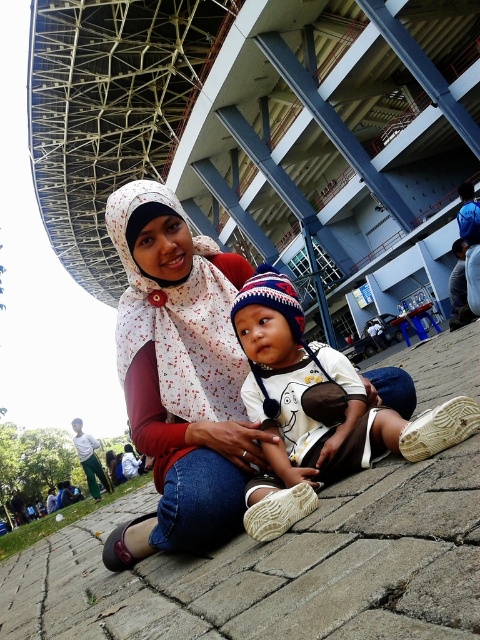
You are a photographer trying to capture a closeup of the white matte baby at center while ensuring the brick pavement at center is visible in the frame. Which object should you focus on first to keep both in the shot?

You should focus on the white matte baby at center first because the brick pavement at center is positioned on the left side of it, so keeping the baby centered will naturally include the pavement in the frame.

You are a photographer trying to capture a closeup of the white matte baby at center without including the brick pavement at center in the frame. Is this possible based on their positions?

The brick pavement at center is positioned under the white matte baby at center, so it is likely that the baby is sitting on the pavement. Therefore, it might not be possible to capture a closeup of the white matte baby at center without including the brick pavement at center in the frame.